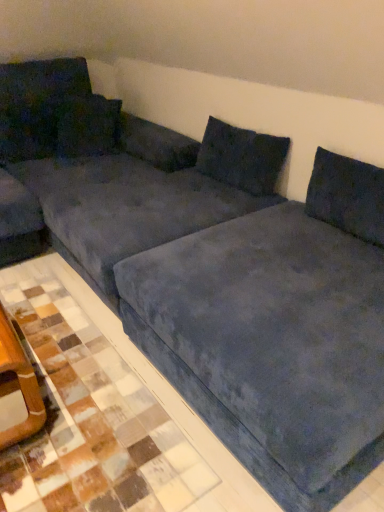
Image resolution: width=384 pixels, height=512 pixels. I want to click on velvet dark blue pillow at upper center, the third pillow when ordered from left to right, so click(x=242, y=157).

What do you see at coordinates (36, 105) in the screenshot? The width and height of the screenshot is (384, 512). I see `velvet dark blue pillow at upper left, which ranks as the third pillow in right-to-left order` at bounding box center [36, 105].

Locate an element on the screen. This screenshot has width=384, height=512. velvet dark blue pillow at upper center, positioned as the 1th pillow in right-to-left order is located at coordinates (242, 157).

Would you say velvet dark blue pillow at upper center, positioned as the 1th pillow in right-to-left order, is outside velvet dark blue pillow at upper left, arranged as the second pillow when viewed from the right?

That's correct, velvet dark blue pillow at upper center, positioned as the 1th pillow in right-to-left order, is outside of velvet dark blue pillow at upper left, arranged as the second pillow when viewed from the right.

Does velvet dark blue pillow at upper center, the third pillow when ordered from left to right, come behind velvet dark blue pillow at upper left, arranged as the second pillow when viewed from the right?

No, velvet dark blue pillow at upper center, the third pillow when ordered from left to right, is in front of velvet dark blue pillow at upper left, arranged as the second pillow when viewed from the right.

Considering the positions of points (197, 167) and (95, 136), is point (197, 167) closer to camera compared to point (95, 136)?

Yes.

Which is more to the right, velvet dark blue pillow at upper center, the third pillow when ordered from left to right, or velvet dark blue pillow at upper left, arranged as the second pillow when viewed from the right?

velvet dark blue pillow at upper center, the third pillow when ordered from left to right.

Which of these two, velvet blue couch at center or velvet dark blue pillow at upper left, positioned as the 1th pillow in left-to-right order, is wider?

Wider between the two is velvet blue couch at center.

From the image's perspective, is velvet blue couch at center under velvet dark blue pillow at upper left, positioned as the 1th pillow in left-to-right order?

Yes, from the image's perspective, velvet blue couch at center is beneath velvet dark blue pillow at upper left, positioned as the 1th pillow in left-to-right order.

From a real-world perspective, is velvet blue couch at center beneath velvet dark blue pillow at upper left, which ranks as the third pillow in right-to-left order?

Yes, from a real-world perspective, velvet blue couch at center is below velvet dark blue pillow at upper left, which ranks as the third pillow in right-to-left order.

Considering the relative sizes of velvet blue couch at center and velvet dark blue pillow at upper left, positioned as the 1th pillow in left-to-right order, in the image provided, is velvet blue couch at center smaller than velvet dark blue pillow at upper left, positioned as the 1th pillow in left-to-right order,?

No.

Choose the correct answer: Is velvet dark blue pillow at upper left, arranged as the second pillow when viewed from the right, inside velvet dark blue pillow at upper left, positioned as the 1th pillow in left-to-right order, or outside it?

The correct answer is: inside.

Is velvet dark blue pillow at upper left, arranged as the second pillow when viewed from the right, facing away from velvet dark blue pillow at upper left, which ranks as the third pillow in right-to-left order?

Correct, velvet dark blue pillow at upper left, arranged as the second pillow when viewed from the right, is looking away from velvet dark blue pillow at upper left, which ranks as the third pillow in right-to-left order.

Are velvet dark blue pillow at upper left, which is the second pillow in left-to-right order, and velvet dark blue pillow at upper left, which ranks as the third pillow in right-to-left order, located far from each other?

Actually, velvet dark blue pillow at upper left, which is the second pillow in left-to-right order, and velvet dark blue pillow at upper left, which ranks as the third pillow in right-to-left order, are a little close together.

Can you confirm if velvet dark blue pillow at upper left, arranged as the second pillow when viewed from the right, is bigger than velvet dark blue pillow at upper left, which ranks as the third pillow in right-to-left order?

Yes, velvet dark blue pillow at upper left, arranged as the second pillow when viewed from the right, is bigger than velvet dark blue pillow at upper left, which ranks as the third pillow in right-to-left order.

Is velvet blue couch at center positioned with its back to blue suede tile at lower right?

velvet blue couch at center is not turned away from blue suede tile at lower right.

Is velvet blue couch at center taller or shorter than blue suede tile at lower right?

In the image, velvet blue couch at center appears to be taller than blue suede tile at lower right.

Are velvet blue couch at center and blue suede tile at lower right beside each other?

They are not placed beside each other.

Find the location of a particular element. bedding that appears below the blue suede tile at lower right (from a real-world perspective) is located at coordinates (271, 345).

Is the position of velvet dark blue pillow at upper center, positioned as the 1th pillow in right-to-left order, more distant than that of velvet blue couch at center?

Yes, velvet dark blue pillow at upper center, positioned as the 1th pillow in right-to-left order, is behind velvet blue couch at center.

Is velvet dark blue pillow at upper center, the third pillow when ordered from left to right, facing away from velvet blue couch at center?

velvet dark blue pillow at upper center, the third pillow when ordered from left to right, is not turned away from velvet blue couch at center.

Is velvet dark blue pillow at upper center, the third pillow when ordered from left to right, thinner than velvet blue couch at center?

Yes.

From a real-world perspective, which is physically below, velvet dark blue pillow at upper center, positioned as the 1th pillow in right-to-left order, or velvet blue couch at center?

In real-world perspective, velvet blue couch at center is lower.

Between point (249, 330) and point (242, 173), which one is positioned in front?

The point (249, 330) is closer to the camera.

Between velvet blue couch at center and velvet dark blue pillow at upper center, the third pillow when ordered from left to right, which one appears on the left side from the viewer's perspective?

Positioned to the left is velvet blue couch at center.

From the image's perspective, is velvet blue couch at center above velvet dark blue pillow at upper center, the third pillow when ordered from left to right?

Incorrect, from the image's perspective, velvet blue couch at center is lower than velvet dark blue pillow at upper center, the third pillow when ordered from left to right.

Is velvet dark blue pillow at upper center, positioned as the 1th pillow in right-to-left order, inside velvet blue couch at center?

Actually, velvet dark blue pillow at upper center, positioned as the 1th pillow in right-to-left order, is outside velvet blue couch at center.

Based on the photo, from the image's perspective, relative to blue suede tile at lower right, is velvet dark blue pillow at upper left, positioned as the 1th pillow in left-to-right order, above or below?

From the image's perspective, velvet dark blue pillow at upper left, positioned as the 1th pillow in left-to-right order, appears above blue suede tile at lower right.

Is point (18, 87) less distant than point (48, 376)?

No, it is not.

Is velvet dark blue pillow at upper left, positioned as the 1th pillow in left-to-right order, bigger or smaller than blue suede tile at lower right?

Clearly, velvet dark blue pillow at upper left, positioned as the 1th pillow in left-to-right order, is larger in size than blue suede tile at lower right.

Based on the photo, is velvet dark blue pillow at upper left, positioned as the 1th pillow in left-to-right order, spatially inside blue suede tile at lower right, or outside of it?

The correct answer is: outside.

In order to click on pillow that appears on the right of velvet dark blue pillow at upper left, arranged as the second pillow when viewed from the right in this screenshot , I will do `click(242, 157)`.

Locate an element on the screen. bedding located in front of the velvet dark blue pillow at upper left, positioned as the 1th pillow in left-to-right order is located at coordinates (271, 345).

When comparing their distances from velvet dark blue pillow at upper left, which ranks as the third pillow in right-to-left order, does velvet dark blue pillow at upper center, positioned as the 1th pillow in right-to-left order, or blue suede tile at lower right seem closer?

velvet dark blue pillow at upper center, positioned as the 1th pillow in right-to-left order, is closer to velvet dark blue pillow at upper left, which ranks as the third pillow in right-to-left order.

From the image, which object appears to be nearer to blue suede tile at lower right, velvet dark blue pillow at upper left, which ranks as the third pillow in right-to-left order, or velvet dark blue pillow at upper left, which is the second pillow in left-to-right order?

Among the two, velvet dark blue pillow at upper left, which is the second pillow in left-to-right order, is located nearer to blue suede tile at lower right.

When comparing their distances from velvet dark blue pillow at upper left, which is the second pillow in left-to-right order, does velvet dark blue pillow at upper left, positioned as the 1th pillow in left-to-right order, or velvet dark blue pillow at upper center, positioned as the 1th pillow in right-to-left order, seem closer?

velvet dark blue pillow at upper left, positioned as the 1th pillow in left-to-right order, is positioned closer to the anchor velvet dark blue pillow at upper left, which is the second pillow in left-to-right order.

Estimate the real-world distances between objects in this image. Which object is further from velvet dark blue pillow at upper left, arranged as the second pillow when viewed from the right, velvet blue couch at center or blue suede tile at lower right?

velvet blue couch at center is positioned further to the anchor velvet dark blue pillow at upper left, arranged as the second pillow when viewed from the right.

Which object lies nearer to the anchor point blue suede tile at lower right, velvet dark blue pillow at upper center, positioned as the 1th pillow in right-to-left order, or velvet dark blue pillow at upper left, positioned as the 1th pillow in left-to-right order?

Among the two, velvet dark blue pillow at upper center, positioned as the 1th pillow in right-to-left order, is located nearer to blue suede tile at lower right.

From the image, which object appears to be nearer to velvet blue couch at center, velvet dark blue pillow at upper left, which is the second pillow in left-to-right order, or velvet dark blue pillow at upper center, the third pillow when ordered from left to right?

velvet dark blue pillow at upper center, the third pillow when ordered from left to right, lies closer to velvet blue couch at center than the other object.

Consider the image. From the image, which object appears to be farther from velvet dark blue pillow at upper center, positioned as the 1th pillow in right-to-left order, velvet dark blue pillow at upper left, which ranks as the third pillow in right-to-left order, or blue suede tile at lower right?

velvet dark blue pillow at upper left, which ranks as the third pillow in right-to-left order, is positioned further to the anchor velvet dark blue pillow at upper center, positioned as the 1th pillow in right-to-left order.

Based on their spatial positions, is velvet dark blue pillow at upper center, the third pillow when ordered from left to right, or velvet blue couch at center further from blue suede tile at lower right?

Based on the image, velvet dark blue pillow at upper center, the third pillow when ordered from left to right, appears to be further to blue suede tile at lower right.

What are the coordinates of `tile located between velvet blue couch at center and velvet dark blue pillow at upper center, the third pillow when ordered from left to right, in the depth direction` in the screenshot? It's located at (92, 417).

In order to click on pillow between blue suede tile at lower right and velvet dark blue pillow at upper left, positioned as the 1th pillow in left-to-right order, from front to back in this screenshot , I will do `click(242, 157)`.

Where is `pillow between velvet blue couch at center and velvet dark blue pillow at upper left, positioned as the 1th pillow in left-to-right order, in the front-back direction`? pillow between velvet blue couch at center and velvet dark blue pillow at upper left, positioned as the 1th pillow in left-to-right order, in the front-back direction is located at coordinates (242, 157).

The width and height of the screenshot is (384, 512). Find the location of `pillow between velvet dark blue pillow at upper left, positioned as the 1th pillow in left-to-right order, and velvet dark blue pillow at upper center, the third pillow when ordered from left to right, in the horizontal direction`. pillow between velvet dark blue pillow at upper left, positioned as the 1th pillow in left-to-right order, and velvet dark blue pillow at upper center, the third pillow when ordered from left to right, in the horizontal direction is located at coordinates (87, 126).